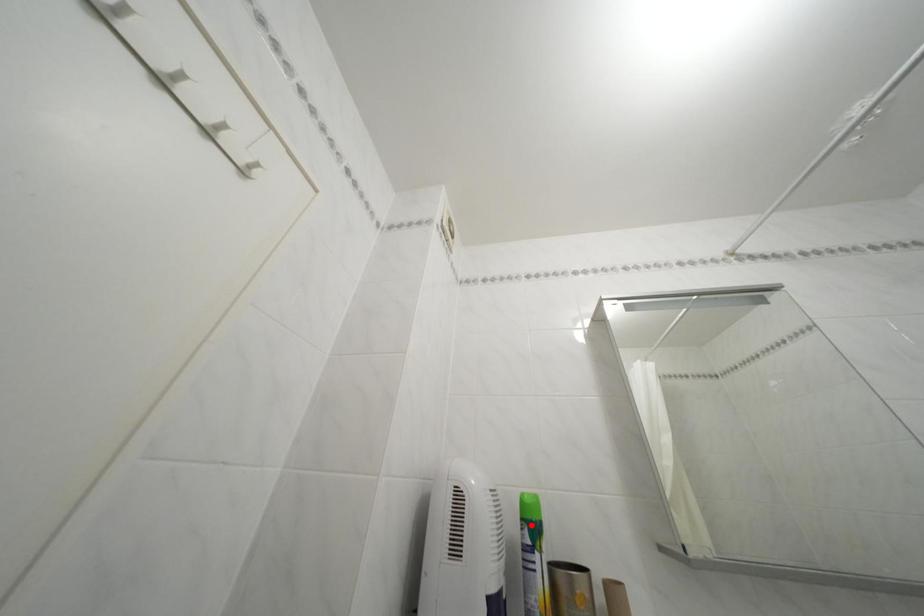
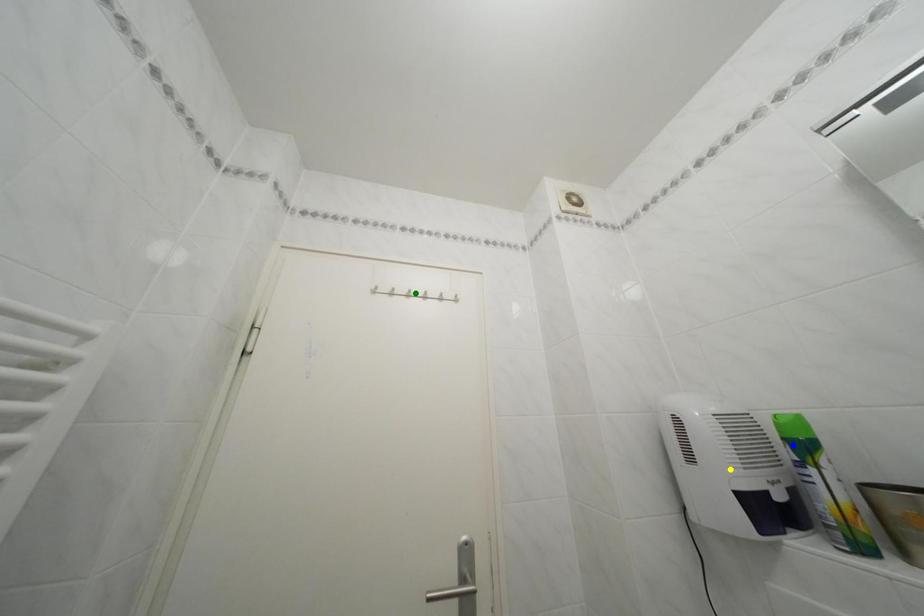
Question: I am providing you with two images of the same scene from different viewpoints. A red point is marked on the first image. You are given multiple points on the second image. Can you choose the point in image 2 that corresponds to the point in image 1?

Choices:
 (A) green point
 (B) yellow point
 (C) blue point

Answer: (C)